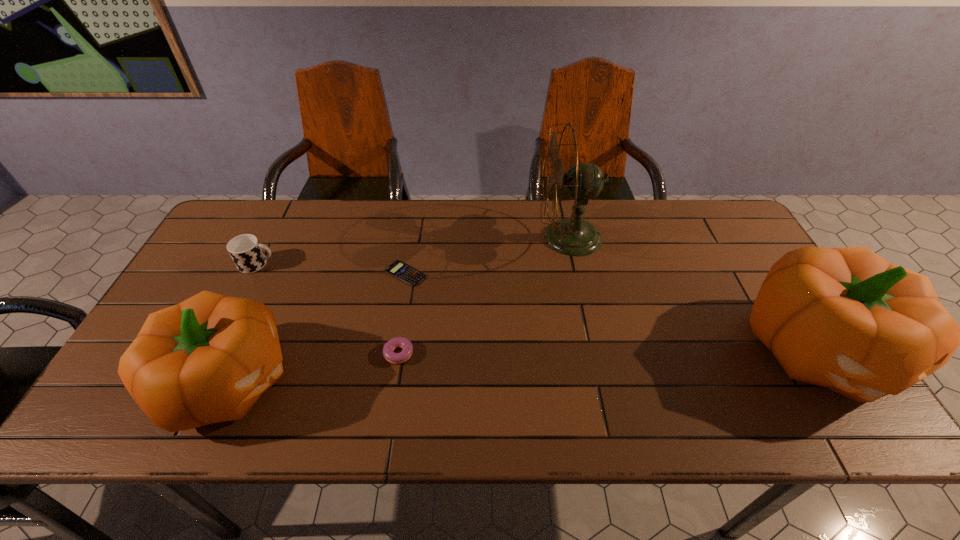
Find the location of a particular element. Image resolution: width=960 pixels, height=540 pixels. vacant spot for a new pumpkin to ensure equal spacing is located at coordinates (532, 366).